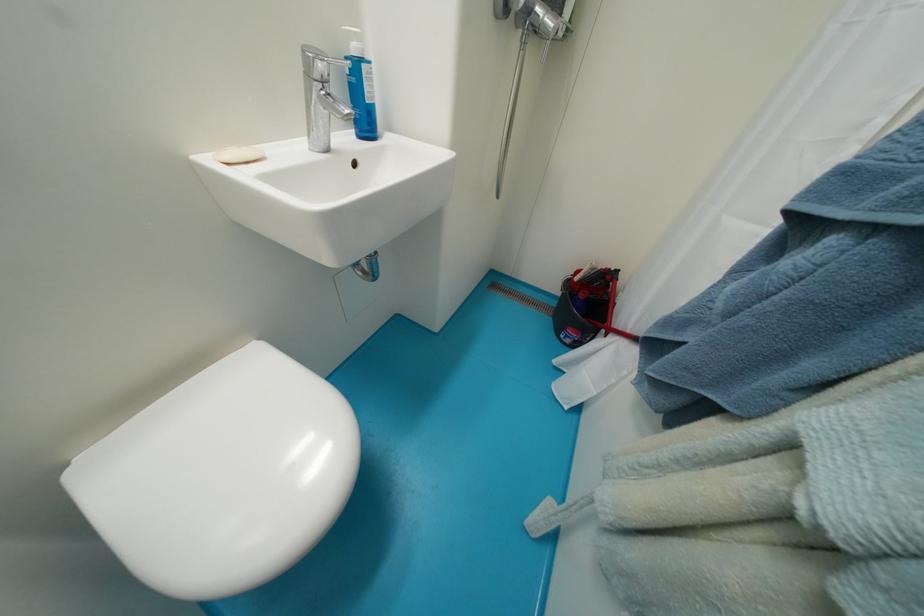
What do you see at coordinates (314, 69) in the screenshot?
I see `the faucet handle` at bounding box center [314, 69].